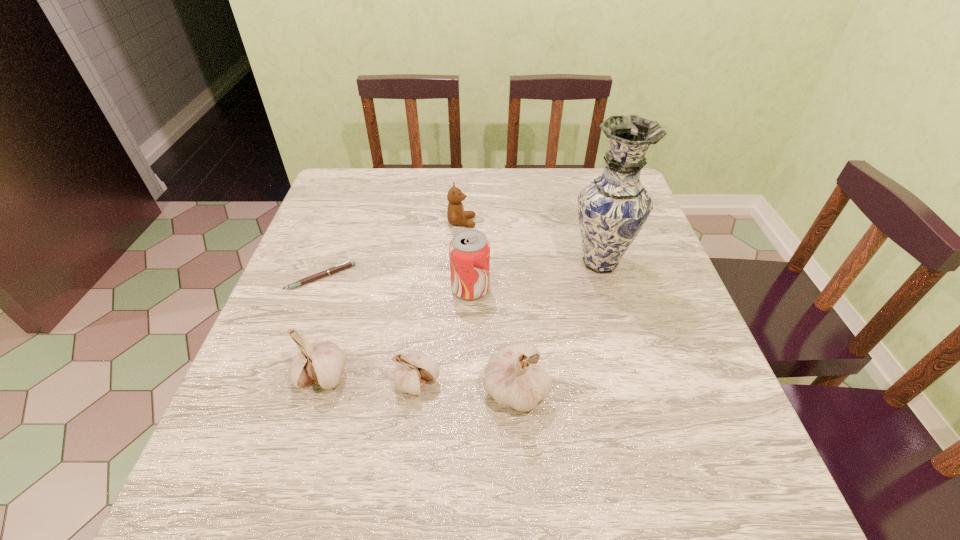
The garlics are evenly distributed in the image. To maintain this, where would you place another garlic on the right? Please point to a free space. Please provide its 2D coordinates. Your answer should be formatted as a tuple, i.e. [(x, y)], where the tuple contains the x and y coordinates of a point satisfying the conditions above.

[(616, 397)]